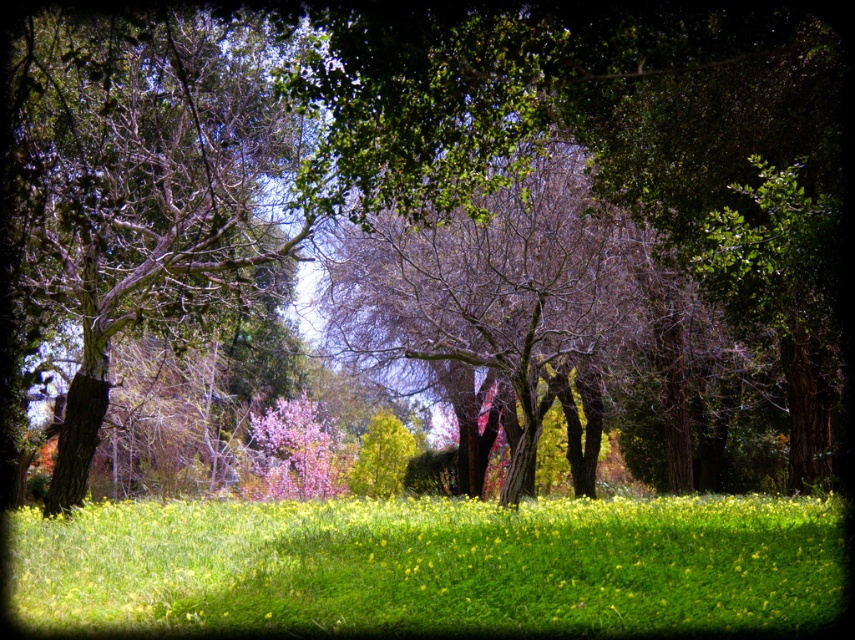
Question: Which point is farther to the camera?

Choices:
 (A) green grass at lower center
 (B) green leafy tree at center
 (C) smooth bark tree at left
 (D) pink silky blossoms at center

Answer: (D)

Question: Is green grass at lower center below pink silky blossoms at center?

Choices:
 (A) yes
 (B) no

Answer: (A)

Question: Does green grass at lower center have a larger size compared to pink silky blossoms at center?

Choices:
 (A) no
 (B) yes

Answer: (B)

Question: Which object appears closest to the camera in this image?

Choices:
 (A) smooth bark tree at left
 (B) green grass at lower center
 (C) pink silky blossoms at center

Answer: (A)

Question: Can you confirm if green grass at lower center is smaller than smooth bark tree at left?

Choices:
 (A) no
 (B) yes

Answer: (B)

Question: Which object appears farthest from the camera in this image?

Choices:
 (A) green grass at lower center
 (B) smooth bark tree at left

Answer: (A)